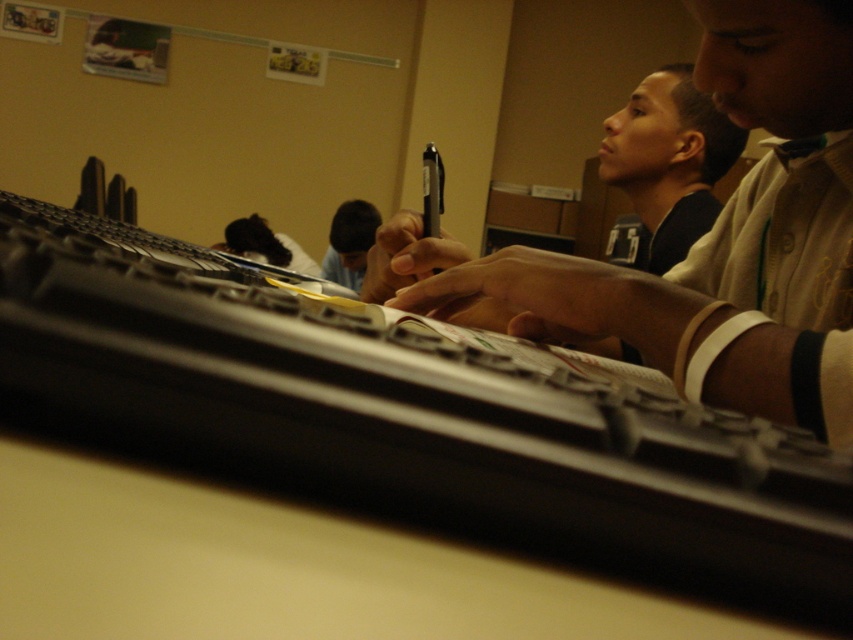
Question: Is black plastic keyboard at center closer to the viewer compared to smooth black hair at center?

Choices:
 (A) no
 (B) yes

Answer: (B)

Question: Does black plastic keyboard at center come behind dark hair at center?

Choices:
 (A) no
 (B) yes

Answer: (A)

Question: Which object appears farthest from the camera in this image?

Choices:
 (A) dark hair at center
 (B) matte black pen at upper center

Answer: (A)

Question: Is black plastic keyboard at center below smooth black hair at center?

Choices:
 (A) yes
 (B) no

Answer: (A)

Question: Among these objects, which one is farthest from the camera?

Choices:
 (A) dark hair at center
 (B) black plastic keyboard at center
 (C) matte black pen at upper center
 (D) smooth black hair at center

Answer: (A)

Question: Which object appears closest to the camera in this image?

Choices:
 (A) dark hair at center
 (B) smooth black hair at center
 (C) black plastic keyboard at center
 (D) matte black shirt at upper center

Answer: (C)